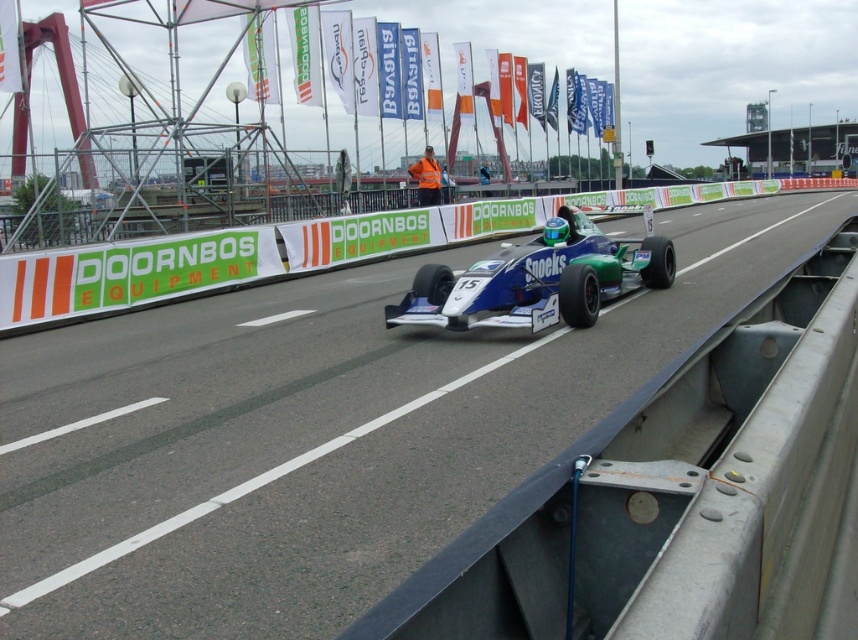
Does smooth asphalt road at center have a lesser height compared to blue glossy race car at center?

No.

Does smooth asphalt road at center appear under blue glossy race car at center?

Correct, smooth asphalt road at center is located below blue glossy race car at center.

Identify the location of smooth asphalt road at center. (313, 435).